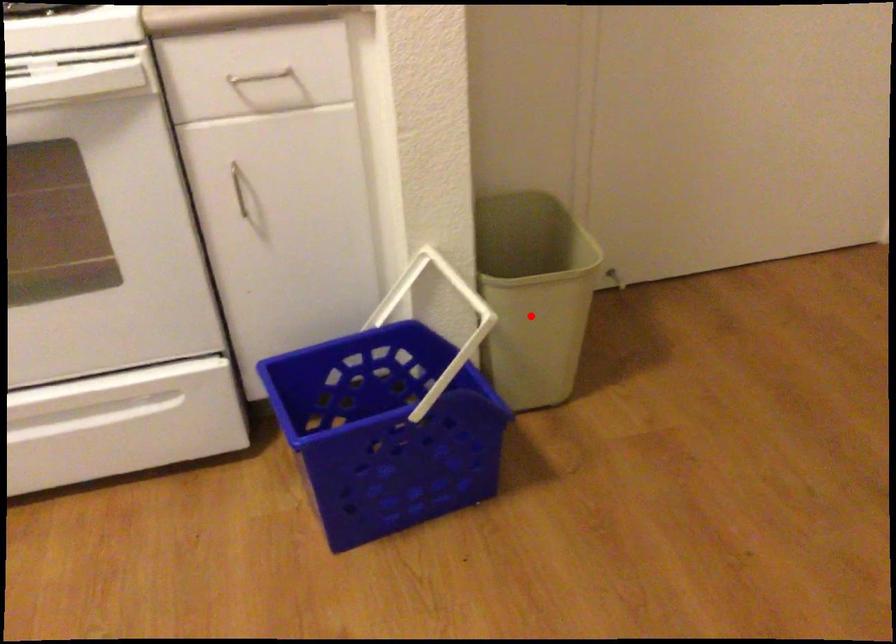
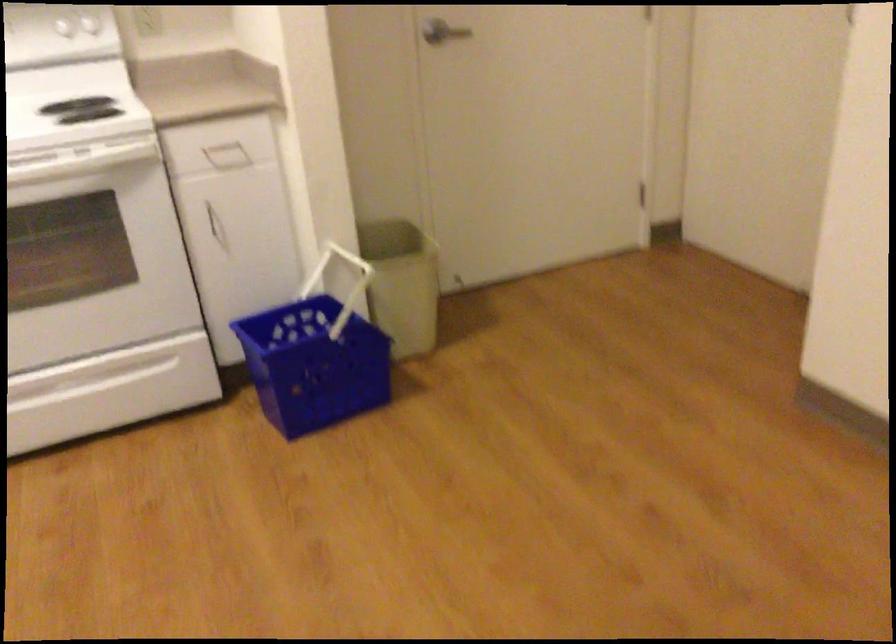
In the second image, find the point that corresponds to the highlighted location in the first image.

(401, 283)